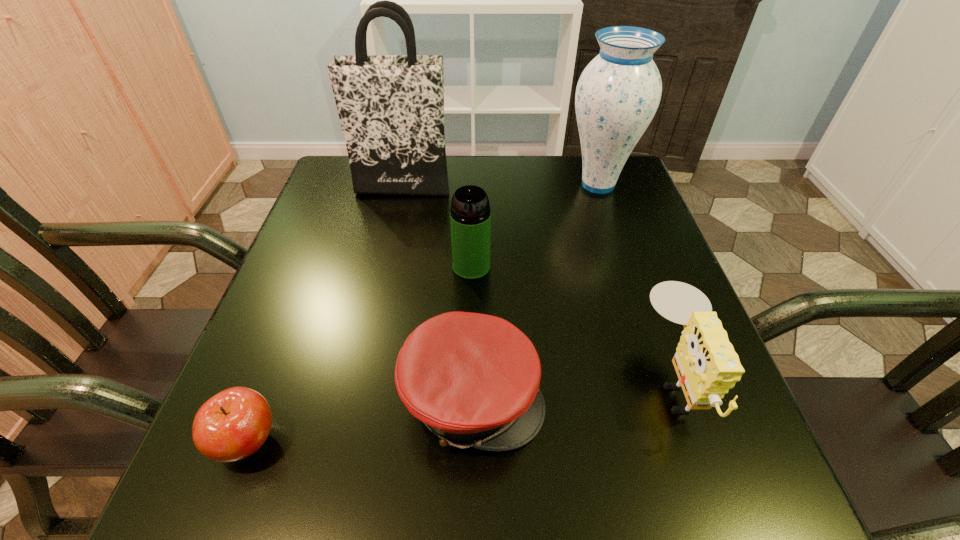
Locate an element on the screen. The width and height of the screenshot is (960, 540). vacant space that's between the apple and the vase is located at coordinates (422, 313).

The image size is (960, 540). I want to click on object that is the closest to the apple, so click(x=473, y=379).

Select which object is the fourth closest to the fourth shortest object. Please provide its 2D coordinates. Your answer should be formatted as a tuple, i.e. [(x, y)], where the tuple contains the x and y coordinates of a point satisfying the conditions above.

[(707, 366)]